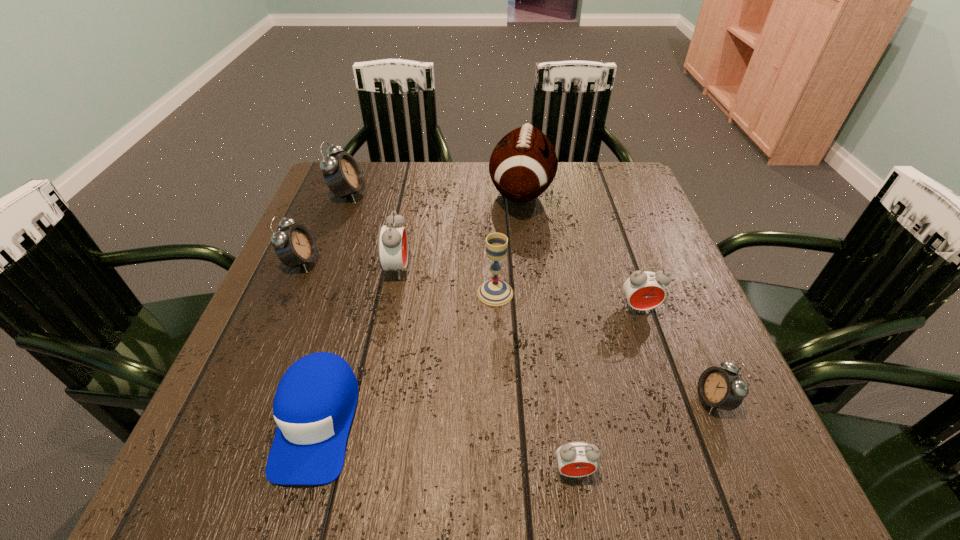
What are the coordinates of `the rightmost alarm clock` in the screenshot? It's located at pos(720,388).

At what (x,y) coordinates should I click in order to perform the action: click on the nearest alarm clock. Please return your answer as a coordinate pair (x, y). Looking at the image, I should click on (577, 458).

You are a GUI agent. You are given a task and a screenshot of the screen. Output one action in this format:
    pyautogui.click(x=<x>, y=<y>)
    Task: Click on the third alarm clock from right to left
    
    Given the screenshot: What is the action you would take?
    pyautogui.click(x=577, y=458)

Where is `blue baseball cap`? The image size is (960, 540). blue baseball cap is located at coordinates (314, 404).

Locate an element on the screen. The image size is (960, 540). vacant region located 0.180m on the right of the football (American) is located at coordinates (619, 193).

The width and height of the screenshot is (960, 540). Find the location of `vacant area situated 0.090m on the face of the farthest alarm clock`. vacant area situated 0.090m on the face of the farthest alarm clock is located at coordinates click(398, 195).

Image resolution: width=960 pixels, height=540 pixels. I want to click on free location located on the face of the third alarm clock from left to right, so click(564, 269).

Where is `vacant region located on the back of the chalice`? vacant region located on the back of the chalice is located at coordinates (492, 190).

I want to click on free space located on the face of the second biggest white alarm clock, so pyautogui.click(x=414, y=262).

The image size is (960, 540). In order to click on free space located on the face of the fifth alarm clock from left to right in this screenshot , I will do `click(657, 361)`.